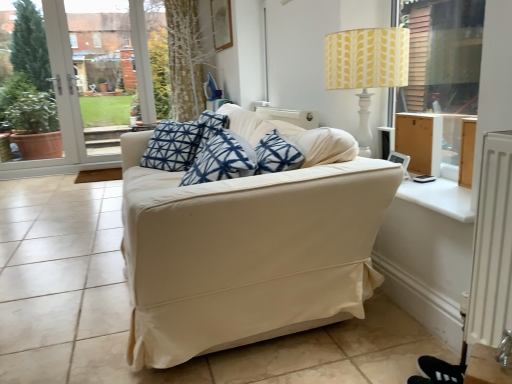
Question: From a real-world perspective, is beige fabric couch at center under white smooth window sill at right?

Choices:
 (A) yes
 (B) no

Answer: (A)

Question: Considering the relative sizes of beige fabric couch at center and white smooth window sill at right in the image provided, is beige fabric couch at center smaller than white smooth window sill at right?

Choices:
 (A) yes
 (B) no

Answer: (B)

Question: Does beige fabric couch at center have a greater width compared to white smooth window sill at right?

Choices:
 (A) yes
 (B) no

Answer: (A)

Question: Can we say beige fabric couch at center lies outside white smooth window sill at right?

Choices:
 (A) no
 (B) yes

Answer: (B)

Question: From the image's perspective, is beige fabric couch at center below white smooth window sill at right?

Choices:
 (A) yes
 (B) no

Answer: (B)

Question: Considering the relative sizes of beige fabric couch at center and white smooth window sill at right in the image provided, is beige fabric couch at center taller than white smooth window sill at right?

Choices:
 (A) no
 (B) yes

Answer: (B)

Question: Is white smooth window sill at right aimed at yellow fabric lampshade at upper right?

Choices:
 (A) no
 (B) yes

Answer: (A)

Question: Is white smooth window sill at right facing away from yellow fabric lampshade at upper right?

Choices:
 (A) yes
 (B) no

Answer: (B)

Question: Considering the relative sizes of white smooth window sill at right and yellow fabric lampshade at upper right in the image provided, is white smooth window sill at right taller than yellow fabric lampshade at upper right?

Choices:
 (A) no
 (B) yes

Answer: (A)

Question: Does white smooth window sill at right appear on the left side of yellow fabric lampshade at upper right?

Choices:
 (A) yes
 (B) no

Answer: (B)

Question: Can you confirm if white smooth window sill at right is shorter than yellow fabric lampshade at upper right?

Choices:
 (A) no
 (B) yes

Answer: (B)

Question: Would you say white smooth window sill at right is a long distance from yellow fabric lampshade at upper right?

Choices:
 (A) yes
 (B) no

Answer: (B)

Question: Is the position of yellow fabric lampshade at upper right more distant than that of white smooth window sill at right?

Choices:
 (A) yes
 (B) no

Answer: (A)